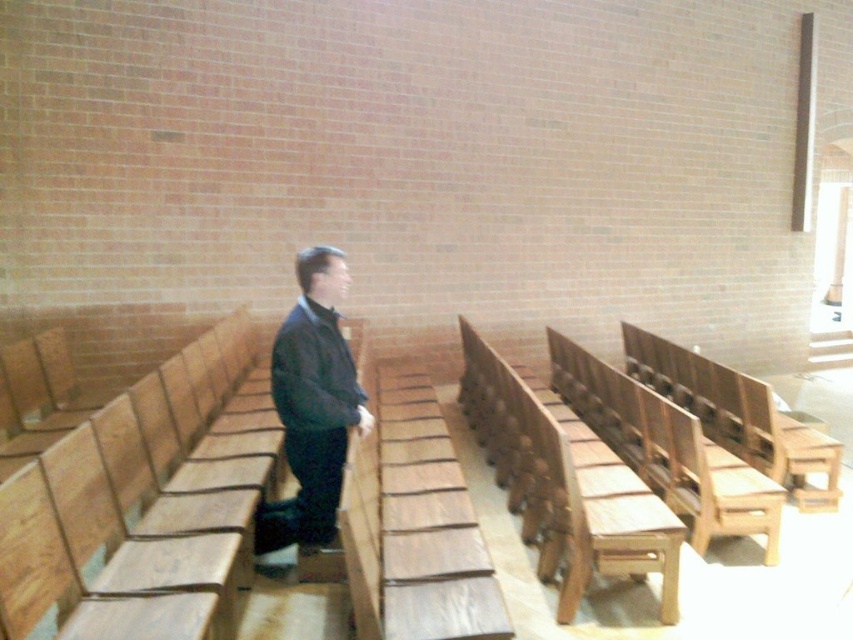
Who is shorter, wooden bench at center or dark blue jacket at center?

Standing shorter between the two is wooden bench at center.

Can you confirm if wooden bench at center is shorter than dark blue jacket at center?

Indeed, wooden bench at center has a lesser height compared to dark blue jacket at center.

What do you see at coordinates (677, 570) in the screenshot? I see `wooden bench at center` at bounding box center [677, 570].

Locate an element on the screen. wooden bench at center is located at coordinates (677, 570).